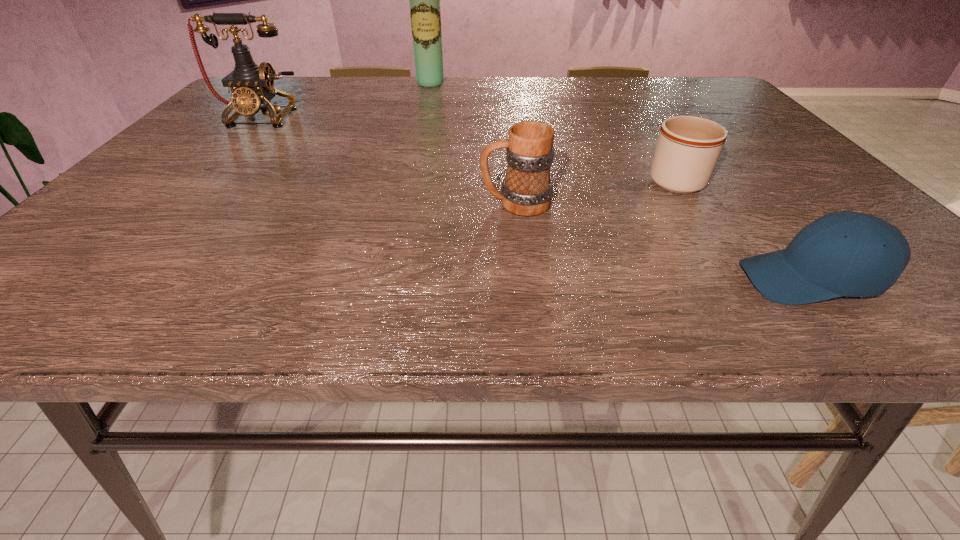
The image size is (960, 540). I want to click on free point located 0.070m on the side of the left mug with the handle, so click(444, 203).

The height and width of the screenshot is (540, 960). Identify the location of free spot located on the side of the left mug with the handle. click(276, 203).

At what (x,y) coordinates should I click in order to perform the action: click on blank space located 0.090m on the side of the left mug with the handle. Please return your answer as a coordinate pair (x, y). Image resolution: width=960 pixels, height=540 pixels. Looking at the image, I should click on (434, 203).

Identify the location of blank space located 0.190m on the side of the shorter mug with the handle. (640, 125).

Where is `free space located on the side of the shorter mug with the handle`? The image size is (960, 540). free space located on the side of the shorter mug with the handle is located at coordinates (629, 107).

Find the location of a particular element. This screenshot has width=960, height=540. free space located 0.300m on the side of the shorter mug with the handle is located at coordinates (630, 109).

Where is `vacant space located on the front-facing side of the baseball cap`? Image resolution: width=960 pixels, height=540 pixels. vacant space located on the front-facing side of the baseball cap is located at coordinates (585, 280).

This screenshot has height=540, width=960. I want to click on vacant space located on the front-facing side of the baseball cap, so click(x=647, y=280).

This screenshot has height=540, width=960. I want to click on free space located 0.060m on the front-facing side of the baseball cap, so click(704, 280).

Identify the location of object positioned at the far edge. (424, 0).